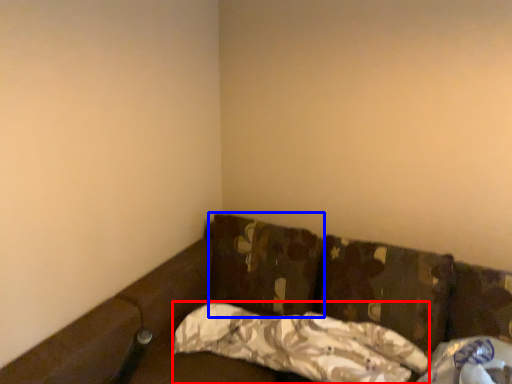
Question: Which of the following is the farthest to the observer, pillow (highlighted by a red box) or pillow (highlighted by a blue box)?

Choices:
 (A) pillow
 (B) pillow

Answer: (B)